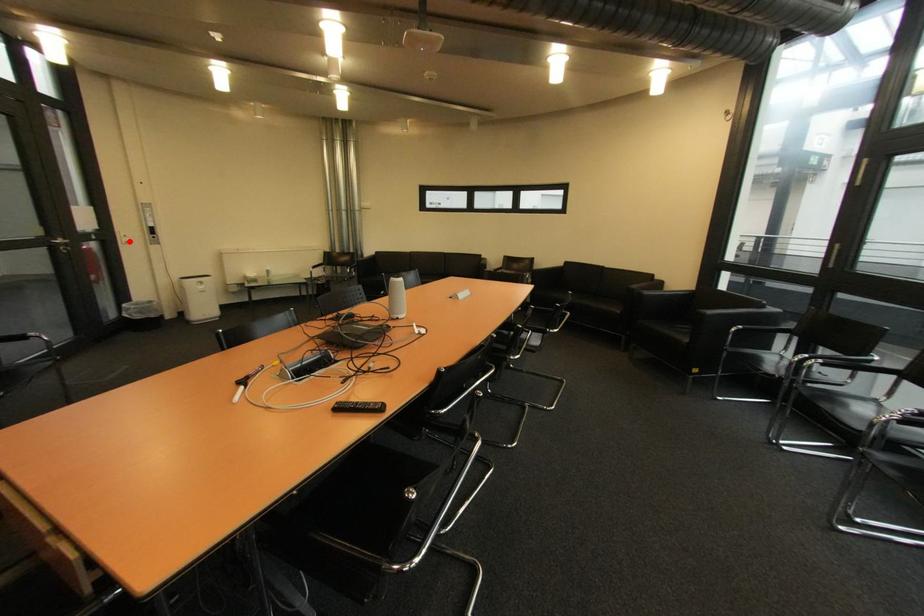
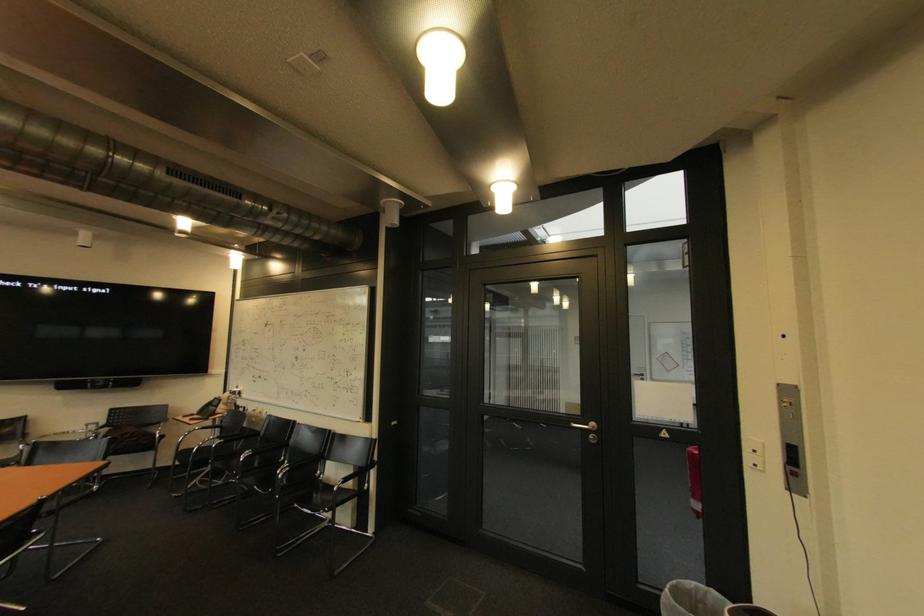
In the second image, find the point that corresponds to the highlighted location in the first image.

(757, 459)